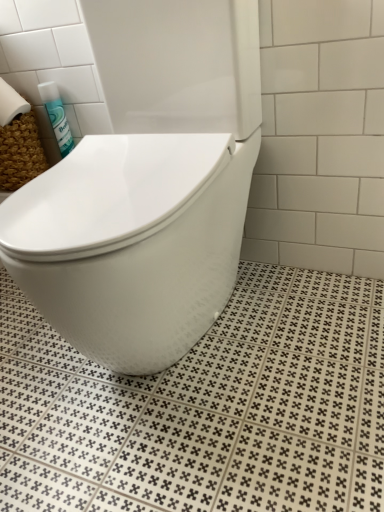
Locate an element on the screen. glossy ceramic toilet at center is located at coordinates (147, 186).

In order to face glossy ceramic toilet at center, should I rotate leftwards or rightwards?

To face it directly, rotate left by 7.122 degrees.

What do you see at coordinates (147, 186) in the screenshot? The width and height of the screenshot is (384, 512). I see `glossy ceramic toilet at center` at bounding box center [147, 186].

I want to click on glossy ceramic toilet at center, so click(147, 186).